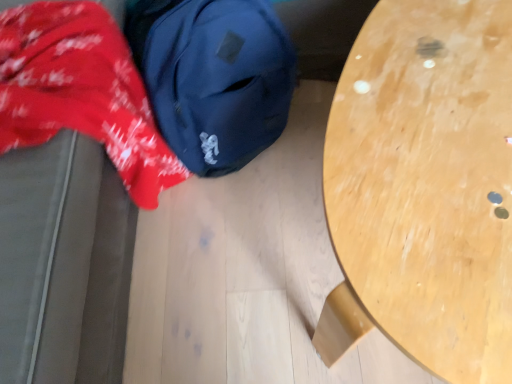
The image size is (512, 384). What do you see at coordinates (81, 91) in the screenshot?
I see `red cotton fabric at left` at bounding box center [81, 91].

Identify the location of light wood table at center. (424, 188).

Where is `navy blue fabric backpack at upper left`? navy blue fabric backpack at upper left is located at coordinates (213, 77).

Is point (45, 140) in front of point (159, 6)?

Yes.

Between red cotton fabric at left and navy blue fabric backpack at upper left, which one has smaller size?

With smaller size is navy blue fabric backpack at upper left.

Locate an element on the screen. The width and height of the screenshot is (512, 384). backpack lying behind the red cotton fabric at left is located at coordinates (213, 77).

Looking at this image, is red cotton fabric at left beside navy blue fabric backpack at upper left?

red cotton fabric at left and navy blue fabric backpack at upper left are clearly separated.

Could you tell me if light wood table at center is facing navy blue fabric backpack at upper left?

No, light wood table at center does not turn towards navy blue fabric backpack at upper left.

Measure the distance between light wood table at center and navy blue fabric backpack at upper left.

The distance of light wood table at center from navy blue fabric backpack at upper left is 41.02 centimeters.

Between point (486, 378) and point (229, 5), which one is positioned in front?

The point (486, 378) is in front.

Would you consider light wood table at center to be distant from navy blue fabric backpack at upper left?

No, light wood table at center is not far away from navy blue fabric backpack at upper left.

From the image's perspective, is navy blue fabric backpack at upper left positioned above or below light wood table at center?

From the image's perspective, navy blue fabric backpack at upper left appears above light wood table at center.

Does navy blue fabric backpack at upper left come behind light wood table at center?

Yes, navy blue fabric backpack at upper left is behind light wood table at center.

Considering the relative sizes of navy blue fabric backpack at upper left and light wood table at center in the image provided, is navy blue fabric backpack at upper left bigger than light wood table at center?

Actually, navy blue fabric backpack at upper left might be smaller than light wood table at center.

Visually, is navy blue fabric backpack at upper left positioned to the left or to the right of light wood table at center?

From the image, it's evident that navy blue fabric backpack at upper left is to the left of light wood table at center.

Who is shorter, red cotton fabric at left or light wood table at center?

With less height is light wood table at center.

Is light wood table at center at the back of red cotton fabric at left?

red cotton fabric at left does not have its back to light wood table at center.

Based on the photo, how far apart are red cotton fabric at left and light wood table at center?

red cotton fabric at left is 47.61 centimeters away from light wood table at center.

Consider the image. Looking at their sizes, would you say red cotton fabric at left is wider or thinner than light wood table at center?

In the image, red cotton fabric at left appears to be wider than light wood table at center.

From a real-world perspective, does light wood table at center stand above red cotton fabric at left?

No, from a real-world perspective, light wood table at center is not on top of red cotton fabric at left.

Which is in front, point (430, 205) or point (165, 166)?

The point (430, 205) is closer.

Identify the location of table behind the red cotton fabric at left. This screenshot has width=512, height=384. (424, 188).

From a real-world perspective, is navy blue fabric backpack at upper left below red cotton fabric at left?

Yes, from a real-world perspective, navy blue fabric backpack at upper left is under red cotton fabric at left.

Consider the image. Which is more to the right, navy blue fabric backpack at upper left or red cotton fabric at left?

navy blue fabric backpack at upper left.

Can you confirm if navy blue fabric backpack at upper left is smaller than red cotton fabric at left?

Yes, navy blue fabric backpack at upper left is smaller than red cotton fabric at left.

Which object is more forward, navy blue fabric backpack at upper left or red cotton fabric at left?

red cotton fabric at left is in front.

Locate an element on the screen. The height and width of the screenshot is (384, 512). clothing lying in front of the navy blue fabric backpack at upper left is located at coordinates (81, 91).

Find the location of a particular element. The height and width of the screenshot is (384, 512). backpack located underneath the light wood table at center (from a real-world perspective) is located at coordinates tap(213, 77).

When comparing their distances from navy blue fabric backpack at upper left, does light wood table at center or red cotton fabric at left seem further?

light wood table at center is positioned further to the anchor navy blue fabric backpack at upper left.

Which object lies further to the anchor point light wood table at center, navy blue fabric backpack at upper left or red cotton fabric at left?

Based on the image, red cotton fabric at left appears to be further to light wood table at center.

When comparing their distances from light wood table at center, does red cotton fabric at left or navy blue fabric backpack at upper left seem closer?

Among the two, navy blue fabric backpack at upper left is located nearer to light wood table at center.

When comparing their distances from red cotton fabric at left, does navy blue fabric backpack at upper left or light wood table at center seem closer?

Based on the image, navy blue fabric backpack at upper left appears to be nearer to red cotton fabric at left.

Looking at the image, which one is located closer to red cotton fabric at left, light wood table at center or navy blue fabric backpack at upper left?

navy blue fabric backpack at upper left is positioned closer to the anchor red cotton fabric at left.

Based on their spatial positions, is red cotton fabric at left or light wood table at center closer to navy blue fabric backpack at upper left?

red cotton fabric at left lies closer to navy blue fabric backpack at upper left than the other object.

This screenshot has height=384, width=512. What are the coordinates of `backpack situated between red cotton fabric at left and light wood table at center from left to right` in the screenshot? It's located at (213, 77).